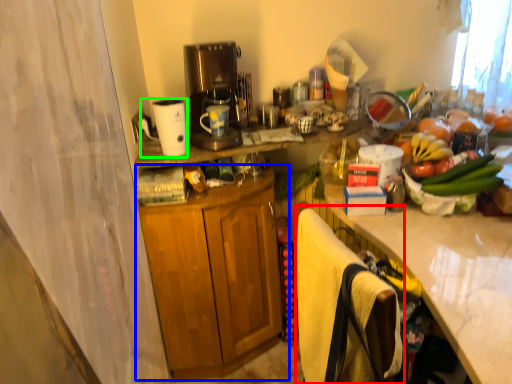
Question: Estimate the real-world distances between objects in this image. Which object is farther from beach towel (highlighted by a red box), cabinetry (highlighted by a blue box) or appliance (highlighted by a green box)?

Choices:
 (A) cabinetry
 (B) appliance

Answer: (B)